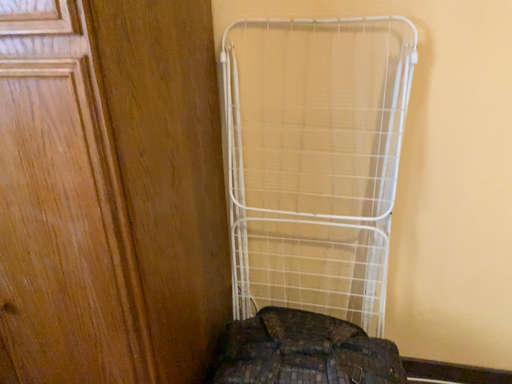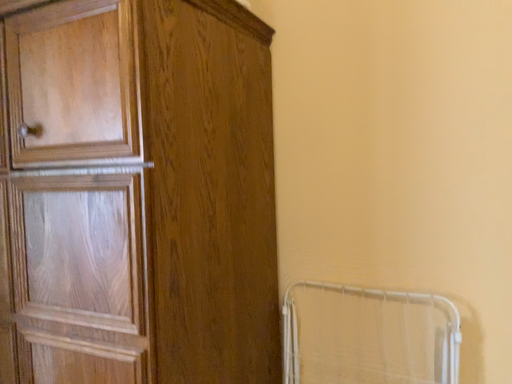
Question: How did the camera likely rotate when shooting the video?

Choices:
 (A) rotated upward
 (B) rotated downward

Answer: (A)